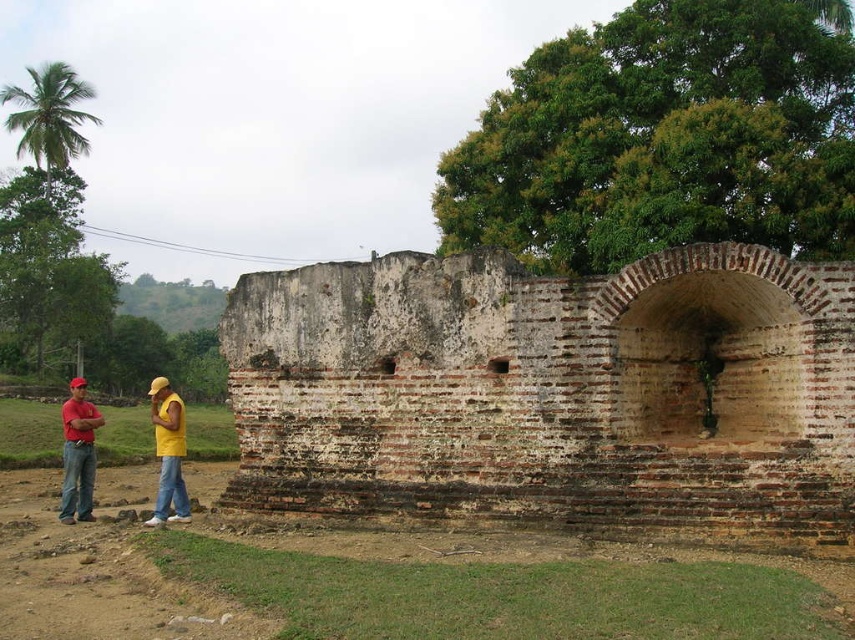
You are a photographer trying to capture the weathered brick wall at center and the matte red cap at left in a single shot. Based on their positions, which object should you focus on first to ensure both are in frame?

The weathered brick wall at center is positioned over matte red cap at left, so you should focus on the matte red cap at left first to ensure both are in frame.

You are a photographer positioned to capture the ruins in the image. You notice the matte red cap at left and the yellow cotton shirt at center. Which object should you focus on first to ensure it appears sharp in your photo?

The matte red cap at left is further to the viewer than the yellow cotton shirt at center, so you should focus on the matte red cap at left first to ensure it appears sharp.